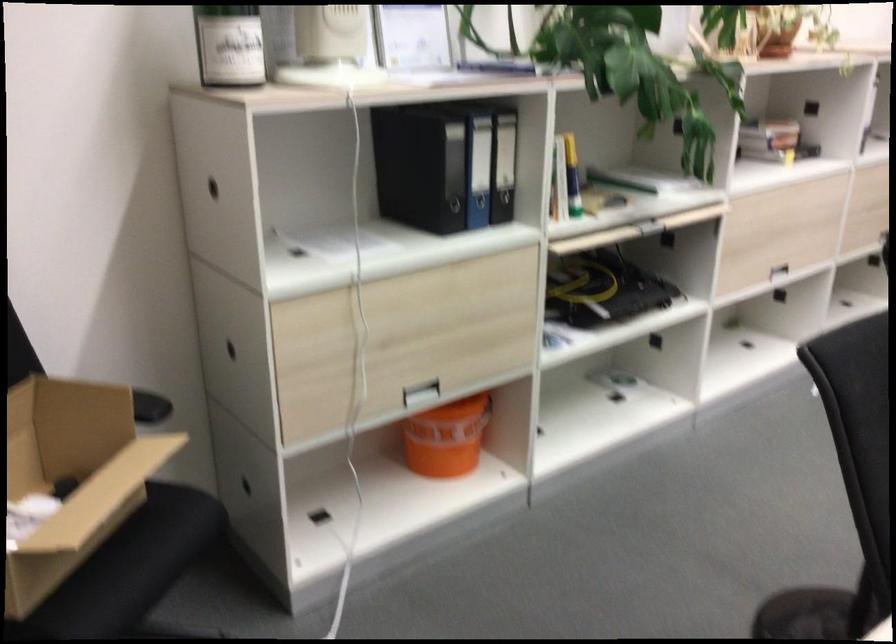
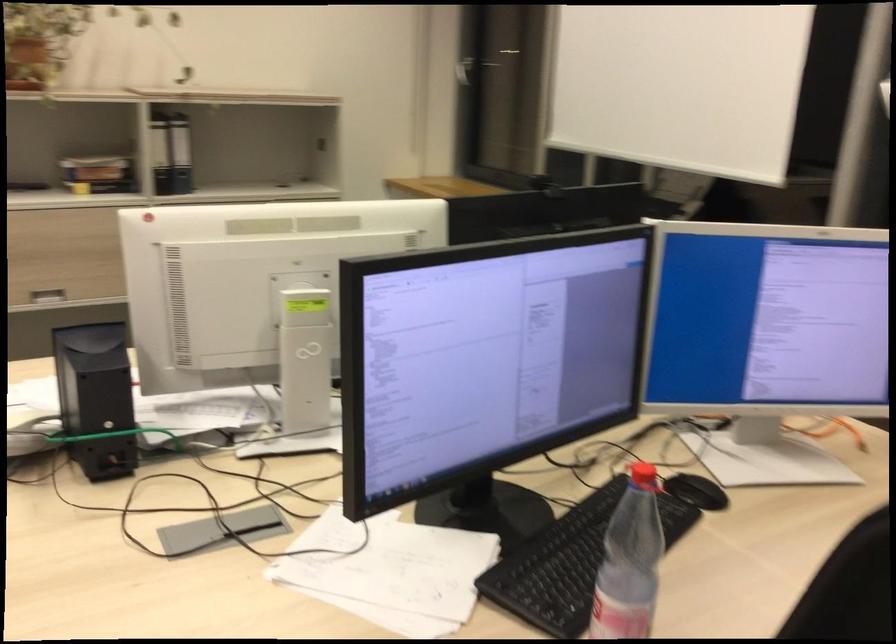
Where in the second image is the point corresponding to (x=787, y=146) from the first image?

(105, 175)